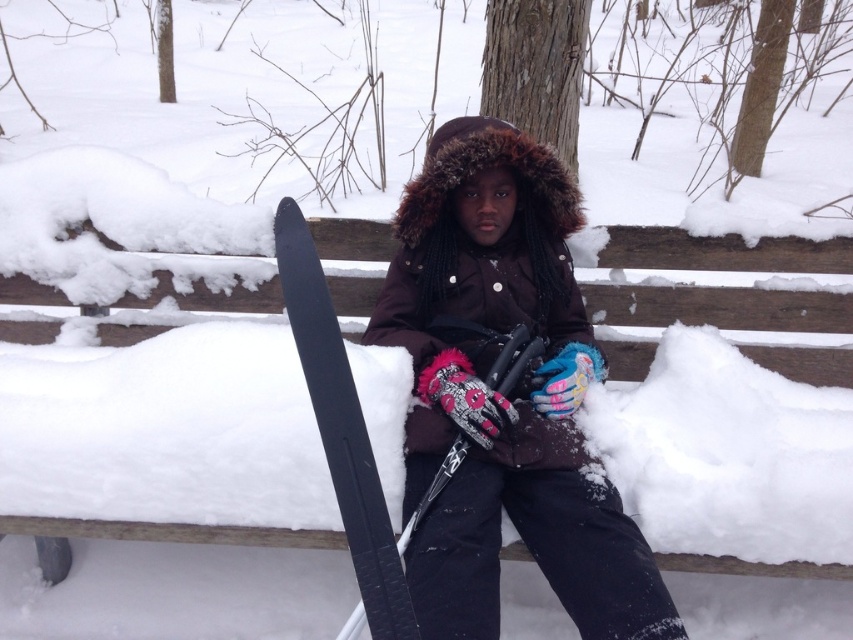
You are standing at the point labeled as point (415, 310) in a snowy winter scene. You want to throw a snowball to someone standing 10 feet away from you. Is the viewer within the throwing distance?

The distance between point (415, 310) and the viewer is 8.42 feet, which is less than 10 feet. Therefore, the viewer is within the throwing distance.